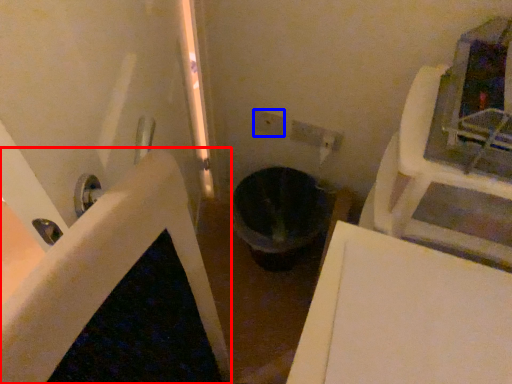
Question: Which object appears farthest to the camera in this image, bath (highlighted by a red box) or electric outlet (highlighted by a blue box)?

Choices:
 (A) bath
 (B) electric outlet

Answer: (A)